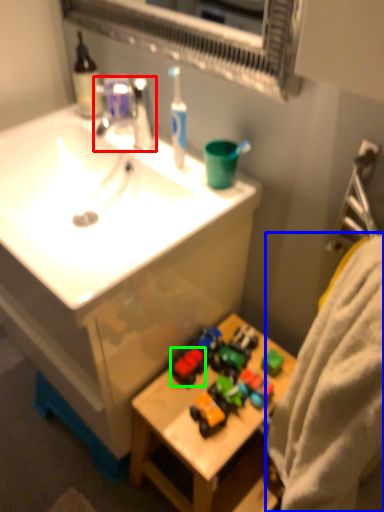
Question: Based on their relative distances, which object is nearer to tap (highlighted by a red box)? Choose from bath towel (highlighted by a blue box) and toy (highlighted by a green box).

Choices:
 (A) bath towel
 (B) toy

Answer: (B)